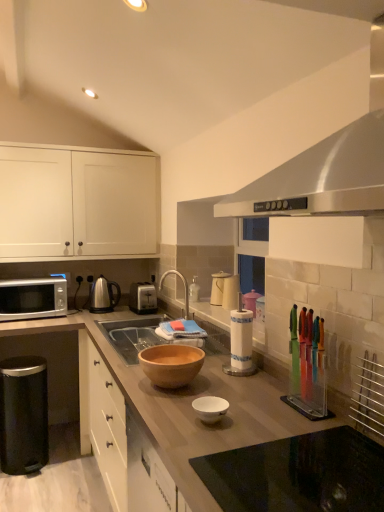
Find the location of a particular element. Image resolution: width=384 pixels, height=512 pixels. spots to the right of black matte trash can at lower left, which is the third appliance in front-to-back order is located at coordinates (74, 464).